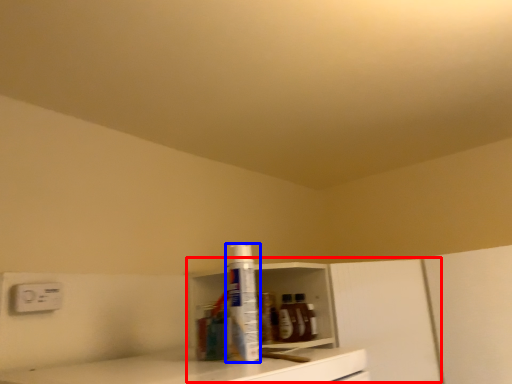
Question: Which object is closer to the camera taking this photo, cabinetry (highlighted by a red box) or bottle (highlighted by a blue box)?

Choices:
 (A) cabinetry
 (B) bottle

Answer: (B)